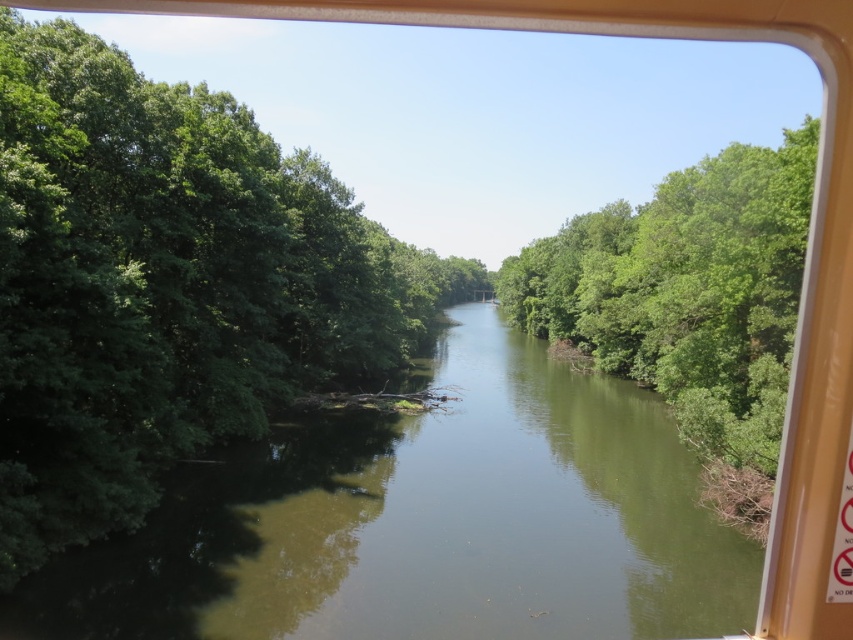
Question: Does green smooth water at center have a lesser width compared to green leafy trees at center?

Choices:
 (A) yes
 (B) no

Answer: (B)

Question: Considering the relative positions of green smooth water at center and green leafy trees at center in the image provided, where is green smooth water at center located with respect to green leafy trees at center?

Choices:
 (A) above
 (B) below

Answer: (B)

Question: Which object appears closest to the camera in this image?

Choices:
 (A) green leafy trees at center
 (B) green smooth water at center

Answer: (B)

Question: Observing the image, what is the correct spatial positioning of green smooth water at center in reference to green leafy trees at center?

Choices:
 (A) left
 (B) right

Answer: (A)

Question: Which object is closer to the camera taking this photo?

Choices:
 (A) green smooth water at center
 (B) green leafy trees at center

Answer: (A)